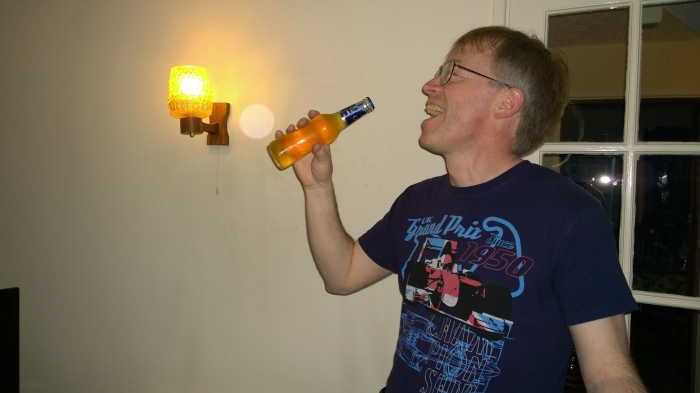
I want to click on light on wall, so click(x=206, y=126).